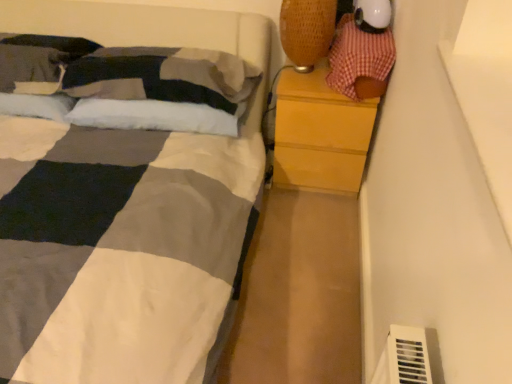
Identify the location of vacant space in between woven fabric table lamp at upper right and checkered fabric toy at upper right. (306, 87).